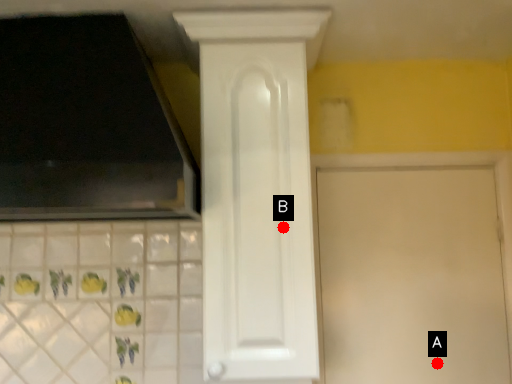
Question: Two points are circled on the image, labeled by A and B beside each circle. Which point is closer to the camera?

Choices:
 (A) A is closer
 (B) B is closer

Answer: (B)